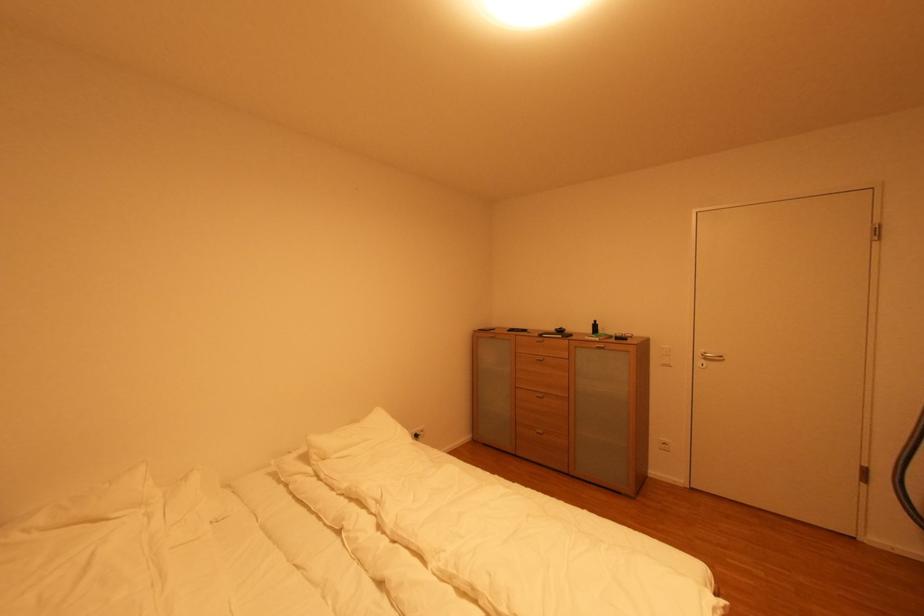
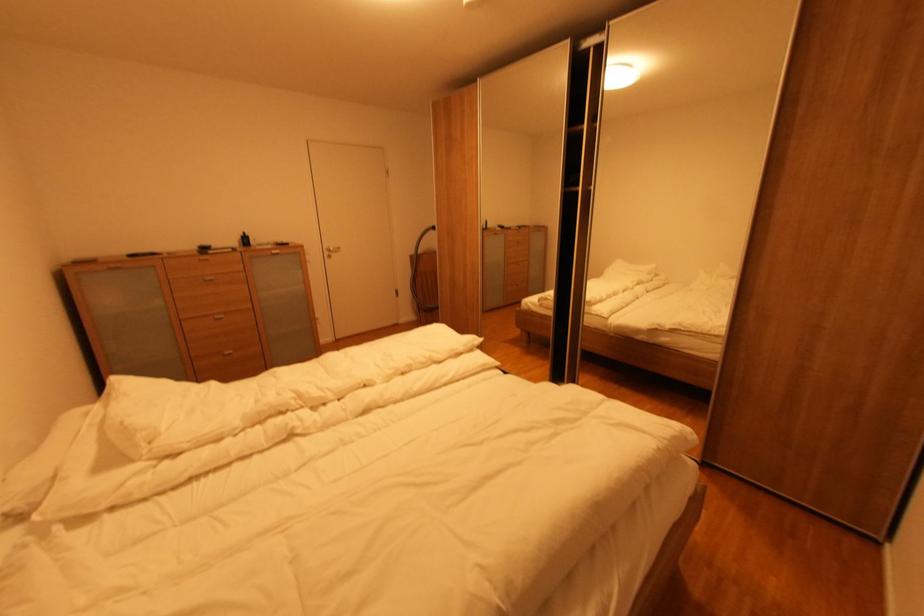
The point at [706,362] is marked in the first image. Where is the corresponding point in the second image?

(333, 254)